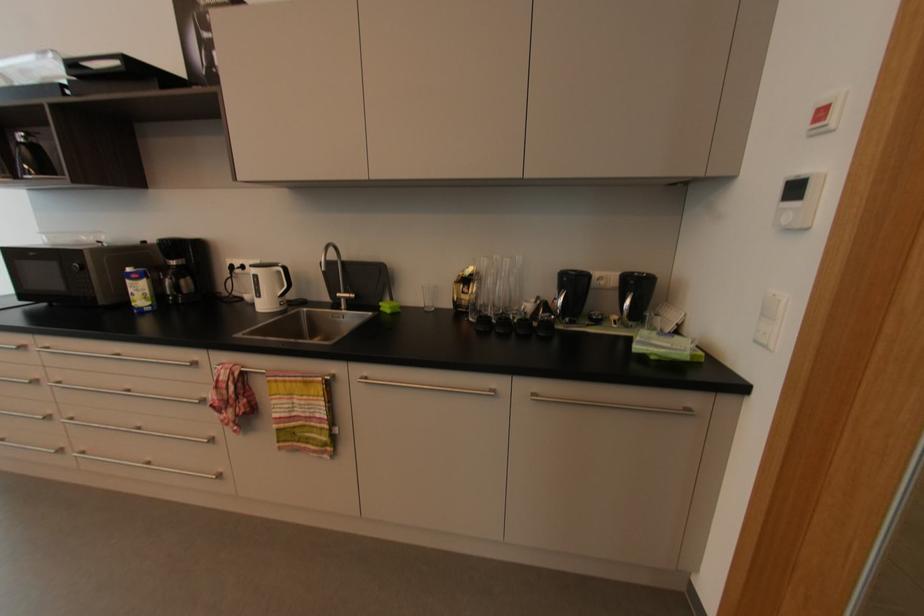
What do you see at coordinates (283, 274) in the screenshot? I see `a white kettle handle` at bounding box center [283, 274].